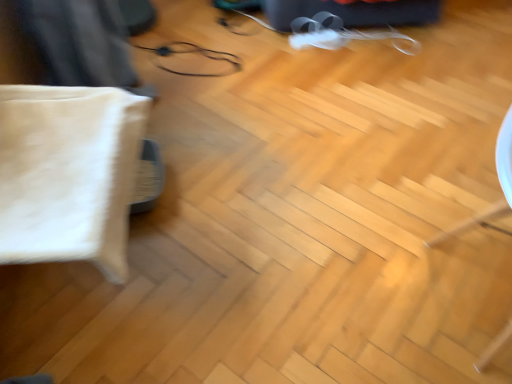
Question: Does white fabric pillow at left appear on the left side of metallic wire at center?

Choices:
 (A) yes
 (B) no

Answer: (A)

Question: Can you confirm if white fabric pillow at left is wider than metallic wire at center?

Choices:
 (A) yes
 (B) no

Answer: (B)

Question: Is white fabric pillow at left facing away from metallic wire at center?

Choices:
 (A) no
 (B) yes

Answer: (A)

Question: From the image's perspective, would you say white fabric pillow at left is shown under metallic wire at center?

Choices:
 (A) no
 (B) yes

Answer: (B)

Question: Is white fabric pillow at left at the right side of metallic wire at center?

Choices:
 (A) yes
 (B) no

Answer: (B)

Question: Is white fabric pillow at left with metallic wire at center?

Choices:
 (A) no
 (B) yes

Answer: (A)

Question: Would you say metallic wire at center is outside white fabric pillow at left?

Choices:
 (A) yes
 (B) no

Answer: (A)

Question: From the image's perspective, does metallic wire at center appear lower than white fabric pillow at left?

Choices:
 (A) no
 (B) yes

Answer: (A)

Question: Can you confirm if metallic wire at center is bigger than white fabric pillow at left?

Choices:
 (A) yes
 (B) no

Answer: (B)

Question: Is metallic wire at center positioned before white fabric pillow at left?

Choices:
 (A) no
 (B) yes

Answer: (A)

Question: Is white fabric pillow at left at the back of metallic wire at center?

Choices:
 (A) yes
 (B) no

Answer: (B)

Question: Does metallic wire at center have a lesser height compared to white fabric pillow at left?

Choices:
 (A) yes
 (B) no

Answer: (A)

Question: Considering the positions of metallic wire at center and white fabric pillow at left in the image, is metallic wire at center bigger or smaller than white fabric pillow at left?

Choices:
 (A) big
 (B) small

Answer: (B)